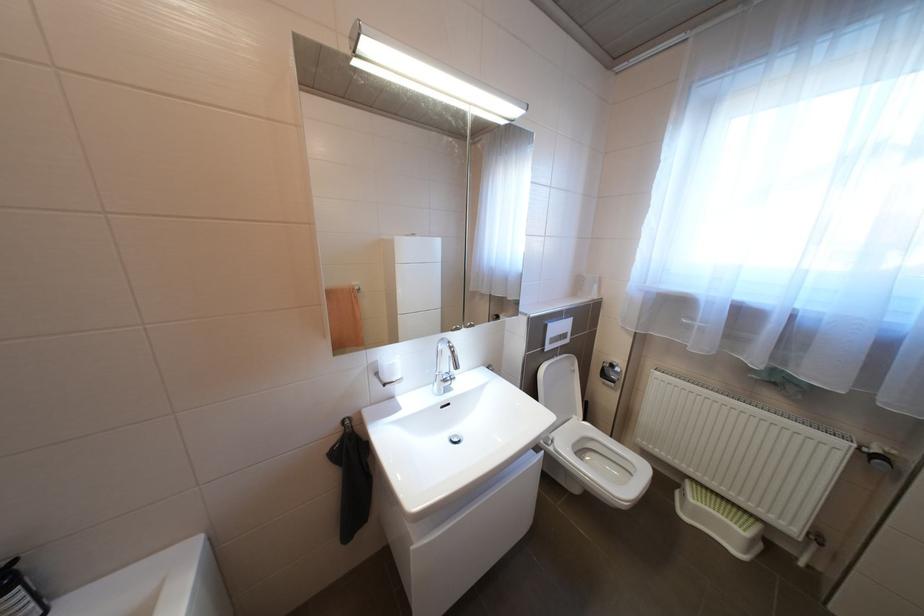
Where would you lift the white toilet lid? Please return your answer as a coordinate pair (x, y).

(561, 386)